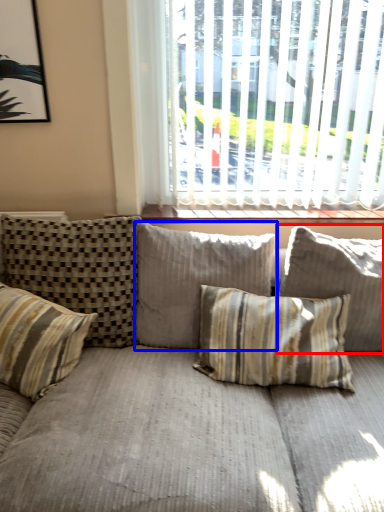
Question: Which of the following is the farthest to the observer, pillow (highlighted by a red box) or pillow (highlighted by a blue box)?

Choices:
 (A) pillow
 (B) pillow

Answer: (B)